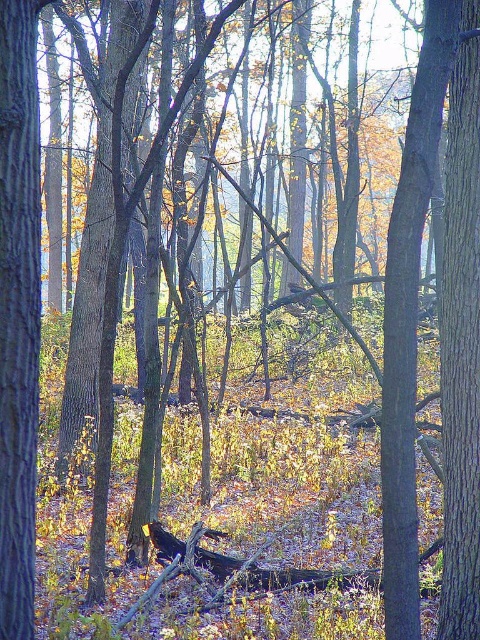
Question: Does smooth brown tree trunk at left have a lesser width compared to smooth bark tree at right?

Choices:
 (A) no
 (B) yes

Answer: (B)

Question: In this image, where is smooth brown tree trunk at center located relative to smooth bark tree at right?

Choices:
 (A) right
 (B) left

Answer: (B)

Question: Among these points, which one is nearest to the camera?

Choices:
 (A) (420, 124)
 (B) (22, 464)

Answer: (A)

Question: Which point is closer to the camera taking this photo?

Choices:
 (A) (23, 552)
 (B) (432, 550)
 (C) (465, 544)
 (D) (476, 198)

Answer: (A)

Question: Which point is closer to the camera taking this photo?

Choices:
 (A) (453, 531)
 (B) (389, 586)
 (C) (27, 349)
 (D) (421, 554)

Answer: (B)

Question: Can you confirm if smooth brown tree trunk at left is positioned to the left of smooth bark tree at right?

Choices:
 (A) yes
 (B) no

Answer: (A)